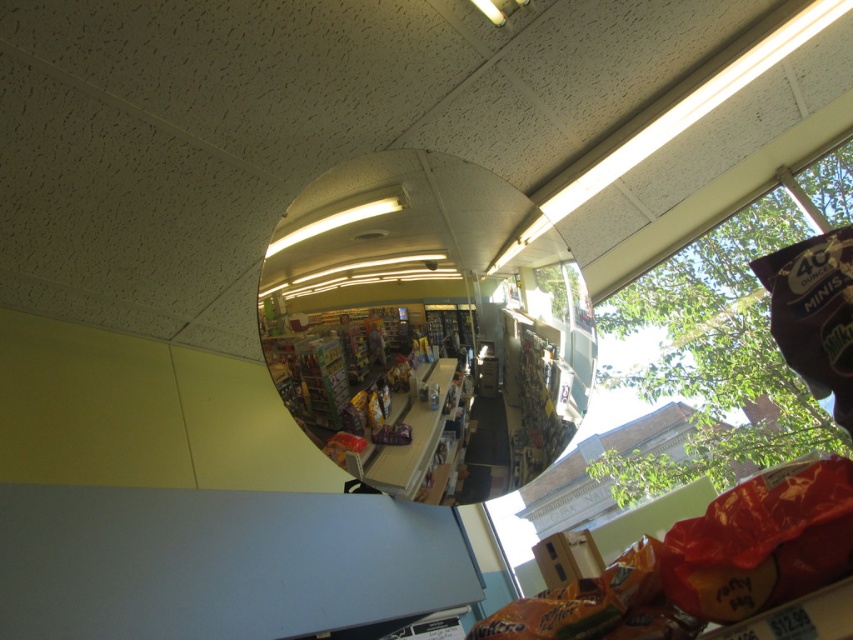
Question: Which point is farther from the camera taking this photo?

Choices:
 (A) (277, 305)
 (B) (785, 499)

Answer: (A)

Question: Which of the following is the farthest from the observer?

Choices:
 (A) clear glass mirror at center
 (B) matte brown bag of chips at center

Answer: (A)

Question: Is clear glass mirror at center wider than matte brown bag of chips at center?

Choices:
 (A) yes
 (B) no

Answer: (A)

Question: Is the position of clear glass mirror at center more distant than that of matte brown bag of chips at center?

Choices:
 (A) no
 (B) yes

Answer: (B)

Question: Can you confirm if clear glass mirror at center is wider than matte brown bag of chips at center?

Choices:
 (A) no
 (B) yes

Answer: (B)